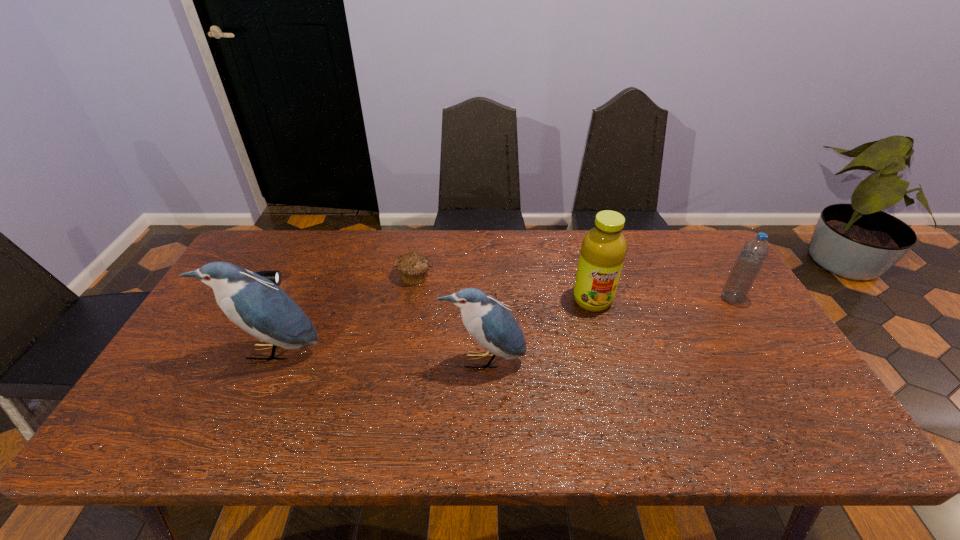
Where is `free space located 0.290m at the lens end of the flashlight`? free space located 0.290m at the lens end of the flashlight is located at coordinates (374, 283).

I want to click on vacant space situated 0.320m on the back of the water bottle, so (689, 231).

Identify the location of vacant region located 0.310m on the front label of the fifth object from left to right. (622, 410).

Locate an element on the screen. The height and width of the screenshot is (540, 960). free region located on the left of the muffin is located at coordinates (351, 275).

This screenshot has width=960, height=540. I want to click on object that is at the far edge, so click(x=413, y=267).

Where is `bird located in the left edge section of the desktop`? bird located in the left edge section of the desktop is located at coordinates (254, 303).

Locate an element on the screen. This screenshot has height=540, width=960. flashlight at the left edge is located at coordinates tap(275, 276).

Locate an element on the screen. The height and width of the screenshot is (540, 960). object present at the right edge is located at coordinates (752, 256).

Identify the location of vacant space at the far edge. (372, 239).

Image resolution: width=960 pixels, height=540 pixels. In order to click on free point at the near edge in this screenshot , I will do `click(559, 387)`.